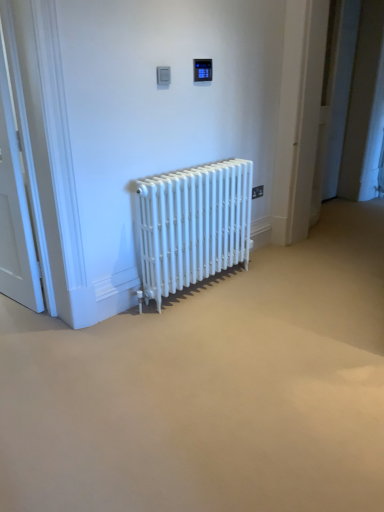
Question: Is white matte radiator at center positioned far away from black plastic electric outlet at upper center?

Choices:
 (A) yes
 (B) no

Answer: (B)

Question: Is the depth of white matte radiator at center less than that of black plastic electric outlet at upper center?

Choices:
 (A) yes
 (B) no

Answer: (A)

Question: Considering the relative sizes of white matte radiator at center and black plastic electric outlet at upper center in the image provided, is white matte radiator at center taller than black plastic electric outlet at upper center?

Choices:
 (A) yes
 (B) no

Answer: (A)

Question: Is white matte radiator at center outside of black plastic electric outlet at upper center?

Choices:
 (A) yes
 (B) no

Answer: (A)

Question: From a real-world perspective, is white matte radiator at center physically above black plastic electric outlet at upper center?

Choices:
 (A) no
 (B) yes

Answer: (A)

Question: Is white matte radiator at center next to black plastic electric outlet at upper center?

Choices:
 (A) no
 (B) yes

Answer: (A)

Question: Considering the relative sizes of black plastic electric outlet at upper center and white matte radiator at center in the image provided, is black plastic electric outlet at upper center bigger than white matte radiator at center?

Choices:
 (A) yes
 (B) no

Answer: (B)

Question: Can you confirm if black plastic electric outlet at upper center is smaller than white matte radiator at center?

Choices:
 (A) no
 (B) yes

Answer: (B)

Question: From a real-world perspective, is black plastic electric outlet at upper center under white matte radiator at center?

Choices:
 (A) no
 (B) yes

Answer: (A)

Question: Is black plastic electric outlet at upper center closer to camera compared to white matte radiator at center?

Choices:
 (A) yes
 (B) no

Answer: (B)

Question: From a real-world perspective, is black plastic electric outlet at upper center over white matte radiator at center?

Choices:
 (A) no
 (B) yes

Answer: (B)

Question: Can you confirm if black plastic electric outlet at upper center is taller than white matte radiator at center?

Choices:
 (A) yes
 (B) no

Answer: (B)

Question: Can you confirm if white wooden door at left is positioned to the right of white matte radiator at center?

Choices:
 (A) yes
 (B) no

Answer: (B)